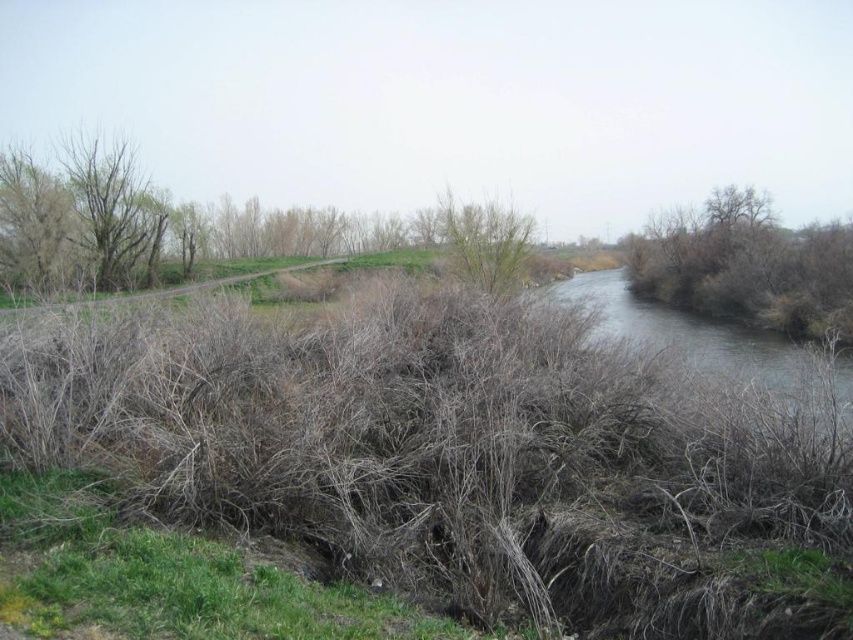
Question: Does brown dry shrub at right appear on the right side of bare branches at left?

Choices:
 (A) yes
 (B) no

Answer: (A)

Question: Which object is farther from the camera taking this photo?

Choices:
 (A) brown dry shrub at right
 (B) bare branches at left

Answer: (B)

Question: Can you confirm if brown dry shrub at right is positioned below bare branches at left?

Choices:
 (A) yes
 (B) no

Answer: (A)

Question: Can you confirm if brown dry shrub at right is thinner than bare branches at left?

Choices:
 (A) no
 (B) yes

Answer: (A)